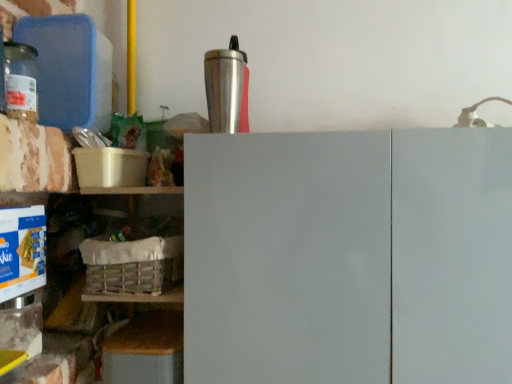
Question: Can you confirm if silver metallic tumbler at upper center is wider than translucent glass jar at left?

Choices:
 (A) no
 (B) yes

Answer: (B)

Question: Considering the relative sizes of silver metallic tumbler at upper center and translucent glass jar at left in the image provided, is silver metallic tumbler at upper center thinner than translucent glass jar at left?

Choices:
 (A) no
 (B) yes

Answer: (A)

Question: Considering the relative sizes of silver metallic tumbler at upper center and translucent glass jar at left in the image provided, is silver metallic tumbler at upper center smaller than translucent glass jar at left?

Choices:
 (A) yes
 (B) no

Answer: (B)

Question: Is translucent glass jar at left inside silver metallic tumbler at upper center?

Choices:
 (A) yes
 (B) no

Answer: (B)

Question: From the image's perspective, is silver metallic tumbler at upper center beneath translucent glass jar at left?

Choices:
 (A) no
 (B) yes

Answer: (A)

Question: From a real-world perspective, is wooden crate at lower left above or below white woven basket at lower left?

Choices:
 (A) below
 (B) above

Answer: (A)

Question: Relative to white woven basket at lower left, is wooden crate at lower left in front or behind?

Choices:
 (A) front
 (B) behind

Answer: (B)

Question: From the image's perspective, is wooden crate at lower left located above or below white woven basket at lower left?

Choices:
 (A) above
 (B) below

Answer: (B)

Question: Considering the positions of point (102, 203) and point (109, 258), is point (102, 203) closer or farther from the camera than point (109, 258)?

Choices:
 (A) farther
 (B) closer

Answer: (A)

Question: Is silver metallic tumbler at upper center bigger or smaller than white woven basket at lower left?

Choices:
 (A) small
 (B) big

Answer: (A)

Question: Is point (228, 119) closer or farther from the camera than point (96, 240)?

Choices:
 (A) closer
 (B) farther

Answer: (A)

Question: Considering the positions of silver metallic tumbler at upper center and white woven basket at lower left in the image, is silver metallic tumbler at upper center wider or thinner than white woven basket at lower left?

Choices:
 (A) wide
 (B) thin

Answer: (B)

Question: Considering the relative positions of silver metallic tumbler at upper center and white woven basket at lower left in the image provided, is silver metallic tumbler at upper center to the left or to the right of white woven basket at lower left?

Choices:
 (A) left
 (B) right

Answer: (B)

Question: Looking at their shapes, would you say white woven basket at lower left is wider or thinner than white matte cabinet doors at center?

Choices:
 (A) wide
 (B) thin

Answer: (B)

Question: From the image's perspective, relative to white matte cabinet doors at center, is white woven basket at lower left above or below?

Choices:
 (A) below
 (B) above

Answer: (B)